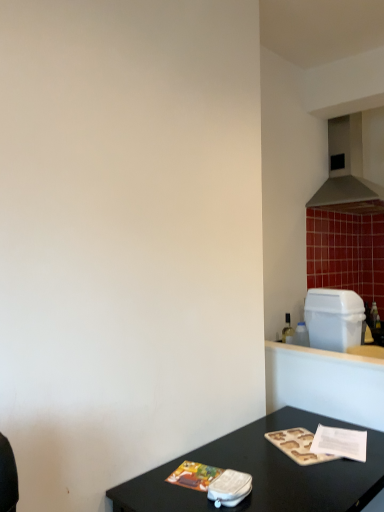
Question: Is metallic gray exhaust hood at upper right in front of or behind black glossy table at lower right in the image?

Choices:
 (A) behind
 (B) front

Answer: (A)

Question: From their relative heights in the image, would you say metallic gray exhaust hood at upper right is taller or shorter than black glossy table at lower right?

Choices:
 (A) short
 (B) tall

Answer: (B)

Question: Estimate the real-world distances between objects in this image. Which object is farther from the metallic gray exhaust hood at upper right?

Choices:
 (A) white plastic trash can at right
 (B) black glossy table at lower right

Answer: (B)

Question: Which of these objects is positioned closest to the metallic gray exhaust hood at upper right?

Choices:
 (A) white plastic trash can at right
 (B) black glossy table at lower right

Answer: (A)